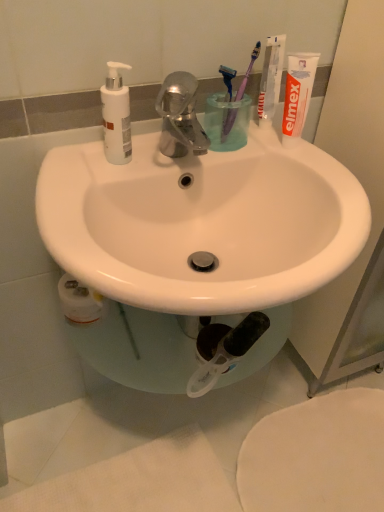
I want to click on free space between white matte pump bottle at upper left and white matte tube of toothpaste at upper right, which is the second toothpaste in left-to-right order, so click(x=203, y=152).